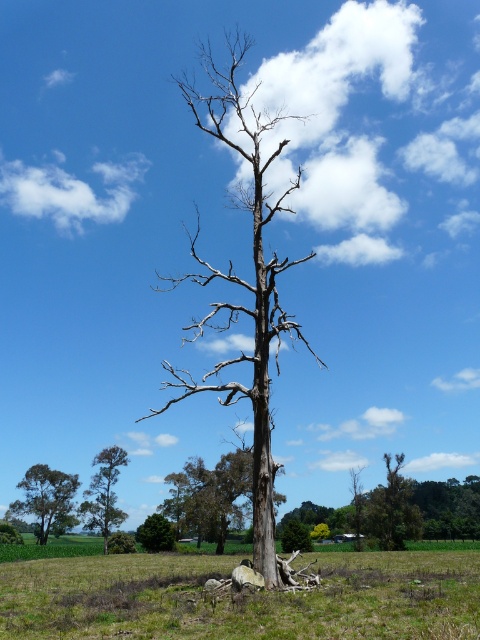
Question: Is green grass at center wider than bare wood tree at center?

Choices:
 (A) yes
 (B) no

Answer: (A)

Question: Does bare wood tree at center have a larger size compared to green leafy tree at lower left?

Choices:
 (A) yes
 (B) no

Answer: (A)

Question: Among these points, which one is farthest from the camera?

Choices:
 (A) (403, 496)
 (B) (435, 579)
 (C) (46, 480)
 (D) (222, 547)

Answer: (C)

Question: Is green leafy tree at lower right smaller than green matte tree at lower center?

Choices:
 (A) yes
 (B) no

Answer: (B)

Question: Which of the following is the farthest from the observer?

Choices:
 (A) bare wood tree at center
 (B) green grass at center
 (C) green matte tree at lower left

Answer: (C)

Question: Which of these objects is positioned closest to the green leafy tree at lower right?

Choices:
 (A) green leafy tree at lower left
 (B) brown rough bark tree at center
 (C) green matte tree at lower left

Answer: (B)